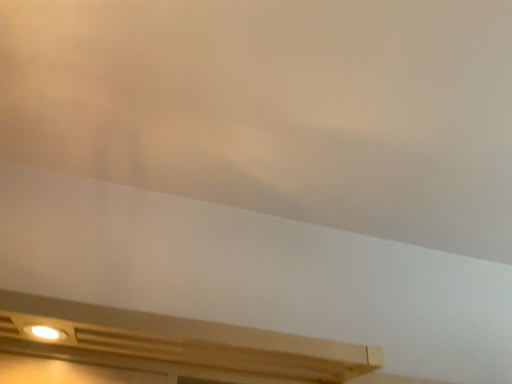
Locate an element on the screen. The width and height of the screenshot is (512, 384). white matte cloud at upper center is located at coordinates (277, 108).

What do you see at coordinates (277, 108) in the screenshot?
I see `white matte cloud at upper center` at bounding box center [277, 108].

Locate an element on the screen. This screenshot has width=512, height=384. white matte cloud at upper center is located at coordinates (277, 108).